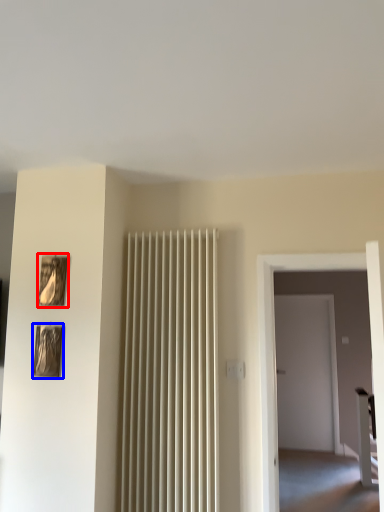
Question: Which point is further to the camera, picture frame (highlighted by a red box) or picture frame (highlighted by a blue box)?

Choices:
 (A) picture frame
 (B) picture frame

Answer: (A)